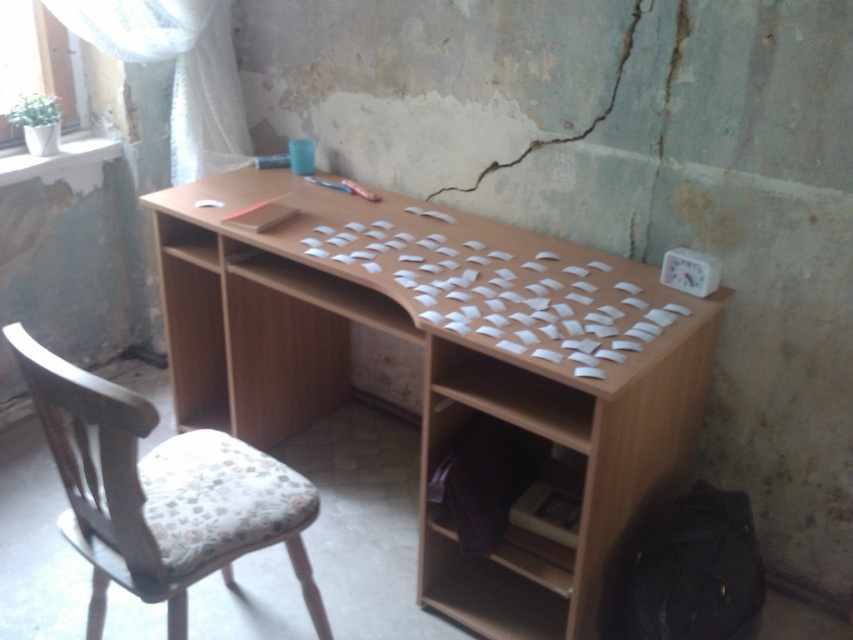
What do you see at coordinates (434, 372) in the screenshot?
I see `light brown wood desk at center` at bounding box center [434, 372].

Does light brown wood desk at center come in front of white sheer curtain at upper left?

Yes, it is in front of white sheer curtain at upper left.

What do you see at coordinates (434, 372) in the screenshot? I see `light brown wood desk at center` at bounding box center [434, 372].

Identify the location of light brown wood desk at center. Image resolution: width=853 pixels, height=640 pixels. (434, 372).

Between light brown wood desk at center and woodenwoodenchair at left, which one has more height?

Standing taller between the two is light brown wood desk at center.

Does point (642, 467) come farther from viewer compared to point (30, 358)?

Yes, it is behind point (30, 358).

Does point (666, 364) come in front of point (97, 524)?

No, it is behind (97, 524).

Where is `light brown wood desk at center`? The height and width of the screenshot is (640, 853). light brown wood desk at center is located at coordinates (434, 372).

The height and width of the screenshot is (640, 853). What do you see at coordinates (160, 493) in the screenshot?
I see `woodenwoodenchair at left` at bounding box center [160, 493].

Is woodenwoodenchair at left shorter than white sheer curtain at upper left?

No, woodenwoodenchair at left is not shorter than white sheer curtain at upper left.

Which is behind, point (206, 481) or point (61, 3)?

Point (61, 3)

Find the location of a particular element. woodenwoodenchair at left is located at coordinates (160, 493).